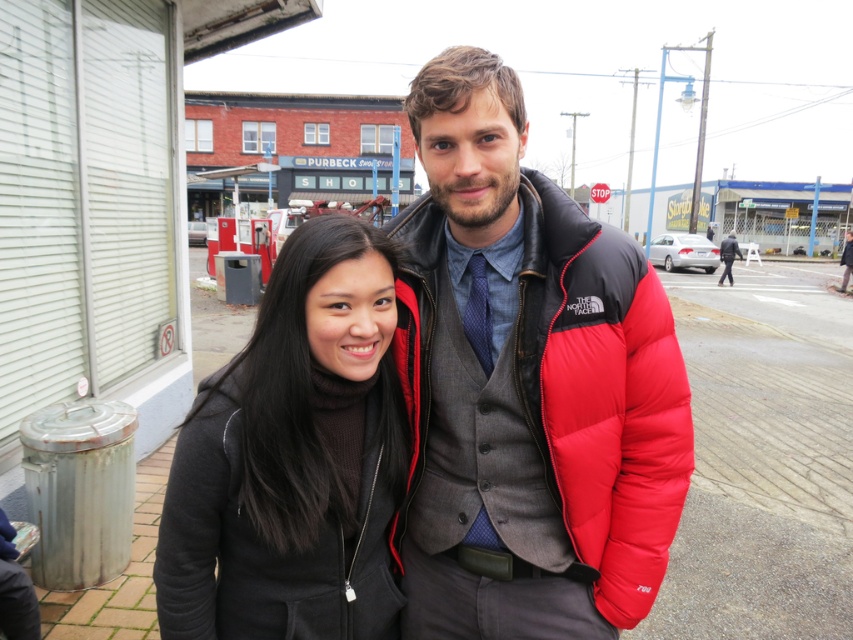
Question: Does matte black jacket at center have a lesser width compared to dark gray wool coat at center?

Choices:
 (A) yes
 (B) no

Answer: (A)

Question: Which point is farther from the camera taking this photo?

Choices:
 (A) (721, 253)
 (B) (587, 250)

Answer: (A)

Question: Which of the following is the farthest from the observer?

Choices:
 (A) (726, 240)
 (B) (165, 573)

Answer: (A)

Question: Is red puffer jacket at center closer to the viewer compared to dark gray wool coat at center?

Choices:
 (A) yes
 (B) no

Answer: (A)

Question: Estimate the real-world distances between objects in this image. Which object is closer to the black matte jacket at center?

Choices:
 (A) matte black jacket at center
 (B) red puffer jacket at center
 (C) dark gray wool coat at center

Answer: (A)

Question: Can you confirm if black matte jacket at center is bigger than dark gray wool coat at center?

Choices:
 (A) no
 (B) yes

Answer: (A)